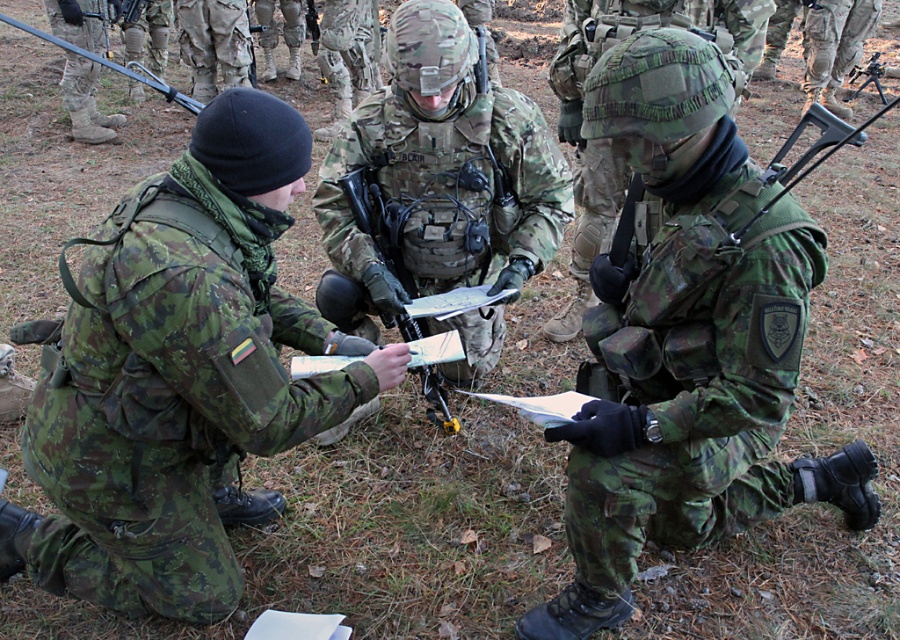
Based on the scene description, which soldier is positioned lower in the image, the camouflage uniform at left or the camouflage fabric uniform at center?

The camouflage uniform at left is located below the camouflage fabric uniform at center in the image.

Based on the coordinates provided, which object is located at point (178,376) in the image?

The point (178,376) corresponds to the camouflage uniform at left.

Looking at the soldiers in the scene, which one has a smaller size between the camouflage uniform at left and the camouflage fabric uniform at center?

The camouflage uniform at left has a smaller size compared to the camouflage fabric uniform at center.